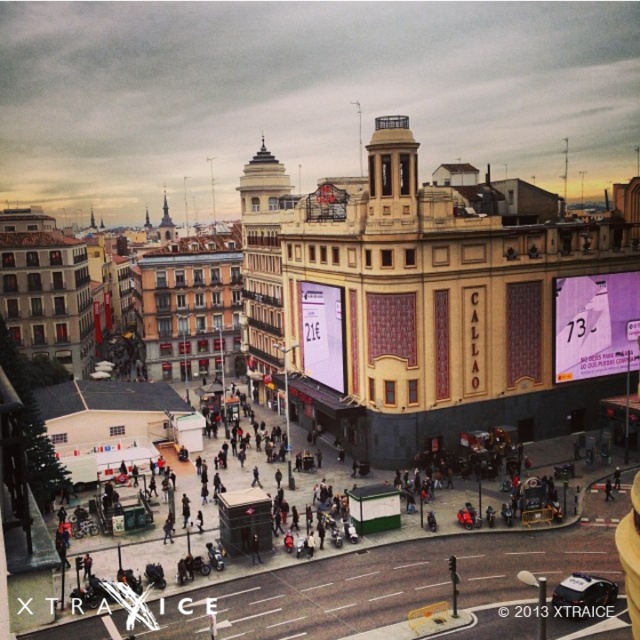
Does matte purple billboard at center have a larger size compared to white glossy sign at center?

Incorrect, matte purple billboard at center is not larger than white glossy sign at center.

From the picture: Can you confirm if matte purple billboard at center is taller than white glossy sign at center?

Indeed, matte purple billboard at center has a greater height compared to white glossy sign at center.

This screenshot has width=640, height=640. Describe the element at coordinates (595, 324) in the screenshot. I see `matte purple billboard at center` at that location.

The height and width of the screenshot is (640, 640). I want to click on matte purple billboard at center, so click(595, 324).

Locate an element on the screen. white textured building at center is located at coordinates (262, 260).

Is white textured building at center in front of matte purple billboard at center?

No, it is behind matte purple billboard at center.

Locate an element on the screen. The image size is (640, 640). white textured building at center is located at coordinates (262, 260).

Does white textured building at center have a lesser width compared to white glossy sign at center?

Incorrect, white textured building at center's width is not less than white glossy sign at center's.

In the scene shown: Who is shorter, white textured building at center or white glossy sign at center?

With less height is white glossy sign at center.

Where is `white textured building at center`? This screenshot has height=640, width=640. white textured building at center is located at coordinates (262, 260).